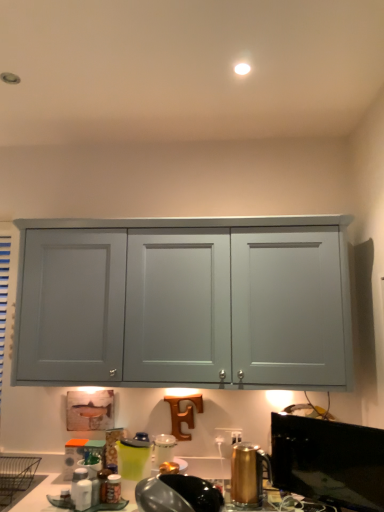
Find the location of a particular element. gold metallic kettle at lower right, which is the third appliance in back-to-front order is located at coordinates (248, 473).

The image size is (384, 512). What do you see at coordinates (177, 494) in the screenshot?
I see `metallic silver toaster at lower center, which is the 4th appliance from back to front` at bounding box center [177, 494].

What is the approximate width of metallic silver toaster at lower center, marked as the third appliance in a left-to-right arrangement?

It is 7.28 inches.

At what (x,y) coordinates should I click in order to perform the action: click on black glossy window screen at lower right. Please return your answer as a coordinate pair (x, y). This screenshot has width=384, height=512. Looking at the image, I should click on (328, 461).

This screenshot has height=512, width=384. Describe the element at coordinates (328, 461) in the screenshot. I see `black glossy window screen at lower right` at that location.

What are the coordinates of `gold metallic kettle at lower right, the 1th appliance in the right-to-left sequence` in the screenshot? It's located at (248, 473).

Considering the relative sizes of gold metallic kettle at lower right, which is the third appliance in back-to-front order, and green plastic pitcher at lower center, the 3th appliance when ordered from right to left, in the image provided, is gold metallic kettle at lower right, which is the third appliance in back-to-front order, shorter than green plastic pitcher at lower center, the 3th appliance when ordered from right to left,?

Yes.

From a real-world perspective, who is located lower, gold metallic kettle at lower right, the 1th appliance in the right-to-left sequence, or green plastic pitcher at lower center, acting as the second appliance starting from the left?

gold metallic kettle at lower right, the 1th appliance in the right-to-left sequence.

Would you say green plastic pitcher at lower center, the second appliance positioned from the back, is part of gold metallic kettle at lower right, the 2th appliance viewed from the front,'s contents?

No, green plastic pitcher at lower center, the second appliance positioned from the back, is not surrounded by gold metallic kettle at lower right, the 2th appliance viewed from the front.

Considering their positions, is gold metallic kettle at lower right, the 4th appliance in the left-to-right sequence, located in front of or behind matte plastic container at lower left, arranged as the 1th appliance when viewed from the left?

gold metallic kettle at lower right, the 4th appliance in the left-to-right sequence, is in front of matte plastic container at lower left, arranged as the 1th appliance when viewed from the left.

Is gold metallic kettle at lower right, which is the third appliance in back-to-front order, inside or outside of matte plastic container at lower left, which appears as the 1th appliance when viewed from the back?

gold metallic kettle at lower right, which is the third appliance in back-to-front order, exists outside the volume of matte plastic container at lower left, which appears as the 1th appliance when viewed from the back.

Between gold metallic kettle at lower right, the 4th appliance in the left-to-right sequence, and matte plastic container at lower left, acting as the fourth appliance starting from the front, which one has smaller size?

matte plastic container at lower left, acting as the fourth appliance starting from the front.

Is point (260, 457) less distant than point (72, 447)?

Yes, point (260, 457) is closer to viewer.

Does point (70, 459) appear closer or farther from the camera than point (369, 432)?

Point (70, 459) is farther from the camera than point (369, 432).

Is matte plastic container at lower left, arranged as the 1th appliance when viewed from the left, placed right next to black glossy window screen at lower right?

matte plastic container at lower left, arranged as the 1th appliance when viewed from the left, and black glossy window screen at lower right are not in contact.

This screenshot has height=512, width=384. Find the location of `window screen in front of the matte plastic container at lower left, the fourth appliance viewed from the right`. window screen in front of the matte plastic container at lower left, the fourth appliance viewed from the right is located at coordinates (328, 461).

How different are the orientations of matte plastic container at lower left, the fourth appliance viewed from the right, and black glossy window screen at lower right in degrees?

matte plastic container at lower left, the fourth appliance viewed from the right, and black glossy window screen at lower right are facing 30.6 degrees away from each other.

Between black glossy window screen at lower right and green plastic pitcher at lower center, the 3th appliance when ordered from right to left, which one has larger width?

With larger width is green plastic pitcher at lower center, the 3th appliance when ordered from right to left.

Between black glossy window screen at lower right and green plastic pitcher at lower center, the second appliance positioned from the back, which one has more height?

black glossy window screen at lower right.

Is point (272, 439) more distant than point (128, 447)?

Yes, it is.

Are black glossy window screen at lower right and green plastic pitcher at lower center, which is the third appliance from front to back, making contact?

No, black glossy window screen at lower right is not touching green plastic pitcher at lower center, which is the third appliance from front to back.

Does black glossy window screen at lower right turn towards matte plastic container at lower left, the fourth appliance viewed from the right?

No, black glossy window screen at lower right is not oriented towards matte plastic container at lower left, the fourth appliance viewed from the right.

Is black glossy window screen at lower right positioned in front of matte plastic container at lower left, which appears as the 1th appliance when viewed from the back?

That is True.

Visually, is black glossy window screen at lower right positioned to the left or to the right of matte plastic container at lower left, the fourth appliance viewed from the right?

Based on their positions, black glossy window screen at lower right is located to the right of matte plastic container at lower left, the fourth appliance viewed from the right.

From the picture: Measure the distance from black glossy window screen at lower right to matte plastic container at lower left, which appears as the 1th appliance when viewed from the back.

1.13 meters.

Between point (147, 484) and point (316, 445), which one is positioned in front?

Point (147, 484)

Considering the relative sizes of metallic silver toaster at lower center, which is the 4th appliance from back to front, and black glossy window screen at lower right in the image provided, is metallic silver toaster at lower center, which is the 4th appliance from back to front, wider than black glossy window screen at lower right?

Yes.

Can you tell me how much metallic silver toaster at lower center, marked as the 1th appliance in a front-to-back arrangement, and black glossy window screen at lower right differ in facing direction?

The angular difference between metallic silver toaster at lower center, marked as the 1th appliance in a front-to-back arrangement, and black glossy window screen at lower right is 34.9 degrees.

The width and height of the screenshot is (384, 512). What are the coordinates of `window screen located above the metallic silver toaster at lower center, the 2th appliance when ordered from right to left (from a real-world perspective)` in the screenshot? It's located at (328, 461).

Is matte plastic container at lower left, acting as the fourth appliance starting from the front, oriented towards gold metallic kettle at lower right, the 1th appliance in the right-to-left sequence?

No.

Is matte plastic container at lower left, which appears as the 1th appliance when viewed from the back, not inside gold metallic kettle at lower right, which is the third appliance in back-to-front order?

That's correct, matte plastic container at lower left, which appears as the 1th appliance when viewed from the back, is outside of gold metallic kettle at lower right, which is the third appliance in back-to-front order.

Is point (65, 447) more distant than point (250, 487)?

Yes, it is behind point (250, 487).

Visually, is matte plastic container at lower left, arranged as the 1th appliance when viewed from the left, positioned to the left or to the right of gold metallic kettle at lower right, the 1th appliance in the right-to-left sequence?

In the image, matte plastic container at lower left, arranged as the 1th appliance when viewed from the left, appears on the left side of gold metallic kettle at lower right, the 1th appliance in the right-to-left sequence.

There is a green plastic pitcher at lower center, which is the third appliance from front to back. At what (x,y) coordinates should I click in order to perform the action: click on the 1st appliance above it (from the image's perspective). Please return your answer as a coordinate pair (x, y). Looking at the image, I should click on (248, 473).

From the gold metallic kettle at lower right, the 1th appliance in the right-to-left sequence, count 2nd appliances backward and point to it. Please provide its 2D coordinates.

[(72, 456)]

Based on the photo, which object lies further to the anchor point matte plastic container at lower left, arranged as the 1th appliance when viewed from the left, gold metallic kettle at lower right, the 2th appliance viewed from the front, or metallic silver toaster at lower center, marked as the 1th appliance in a front-to-back arrangement?

gold metallic kettle at lower right, the 2th appliance viewed from the front, is further to matte plastic container at lower left, arranged as the 1th appliance when viewed from the left.

Based on the photo, based on their spatial positions, is black glossy window screen at lower right or green plastic pitcher at lower center, acting as the second appliance starting from the left, closer to metallic silver toaster at lower center, the 2th appliance when ordered from right to left?

The object closer to metallic silver toaster at lower center, the 2th appliance when ordered from right to left, is green plastic pitcher at lower center, acting as the second appliance starting from the left.

Looking at the image, which one is located further to matte plastic container at lower left, arranged as the 1th appliance when viewed from the left, metallic silver toaster at lower center, the 2th appliance when ordered from right to left, or black glossy window screen at lower right?

Among the two, black glossy window screen at lower right is located further to matte plastic container at lower left, arranged as the 1th appliance when viewed from the left.

Which object lies nearer to the anchor point matte plastic container at lower left, acting as the fourth appliance starting from the front, green plastic pitcher at lower center, which is the third appliance from front to back, or metallic silver toaster at lower center, the 2th appliance when ordered from right to left?

green plastic pitcher at lower center, which is the third appliance from front to back.

When comparing their distances from black glossy window screen at lower right, does matte plastic container at lower left, acting as the fourth appliance starting from the front, or metallic silver toaster at lower center, marked as the third appliance in a left-to-right arrangement, seem further?

matte plastic container at lower left, acting as the fourth appliance starting from the front, is further to black glossy window screen at lower right.

From the image, which object appears to be nearer to metallic silver toaster at lower center, the 2th appliance when ordered from right to left, black glossy window screen at lower right or matte plastic container at lower left, the fourth appliance viewed from the right?

black glossy window screen at lower right lies closer to metallic silver toaster at lower center, the 2th appliance when ordered from right to left, than the other object.

When comparing their distances from black glossy window screen at lower right, does gold metallic kettle at lower right, the 4th appliance in the left-to-right sequence, or matte plastic container at lower left, the fourth appliance viewed from the right, seem further?

matte plastic container at lower left, the fourth appliance viewed from the right, is further to black glossy window screen at lower right.

From the image, which object appears to be farther from metallic silver toaster at lower center, the 2th appliance when ordered from right to left, gold metallic kettle at lower right, the 4th appliance in the left-to-right sequence, or matte plastic container at lower left, which appears as the 1th appliance when viewed from the back?

Based on the image, matte plastic container at lower left, which appears as the 1th appliance when viewed from the back, appears to be further to metallic silver toaster at lower center, the 2th appliance when ordered from right to left.

The height and width of the screenshot is (512, 384). I want to click on appliance between metallic silver toaster at lower center, which is the 4th appliance from back to front, and black glossy window screen at lower right, so click(248, 473).

What are the coordinates of `appliance located between green plastic pitcher at lower center, acting as the second appliance starting from the left, and gold metallic kettle at lower right, the 4th appliance in the left-to-right sequence, in the left-right direction` in the screenshot? It's located at (177, 494).